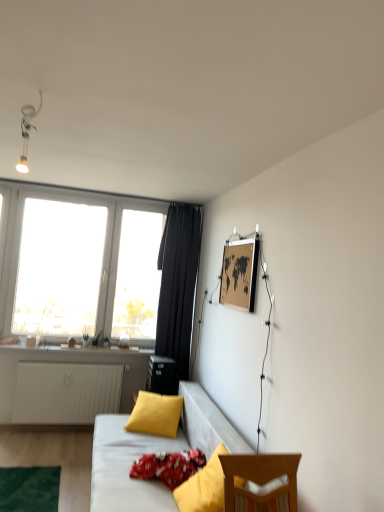
Question: Based on their positions, is red cotton pillow at lower center, arranged as the second pillow when viewed from the back, located to the left or right of wooden map at upper right?

Choices:
 (A) right
 (B) left

Answer: (B)

Question: Relative to wooden map at upper right, is red cotton pillow at lower center, marked as the second pillow in a front-to-back arrangement, in front or behind?

Choices:
 (A) behind
 (B) front

Answer: (B)

Question: Which of these objects is positioned farthest from the wooden map at upper right?

Choices:
 (A) yellow fabric pillow at lower right, which is the 3th pillow in back-to-front order
 (B) transparent glass window at upper left
 (C) black fabric curtain at center
 (D) red cotton pillow at lower center, marked as the second pillow in a front-to-back arrangement
 (E) matte white light fixture at upper left

Answer: (B)

Question: Which object is positioned farthest from the wooden map at upper right?

Choices:
 (A) yellow matte pillow at center, which appears as the first pillow when viewed from the back
 (B) transparent glass window at upper left
 (C) yellow fabric pillow at lower right, marked as the first pillow in a front-to-back arrangement
 (D) matte white light fixture at upper left
 (E) red cotton pillow at lower center, marked as the second pillow in a front-to-back arrangement

Answer: (B)